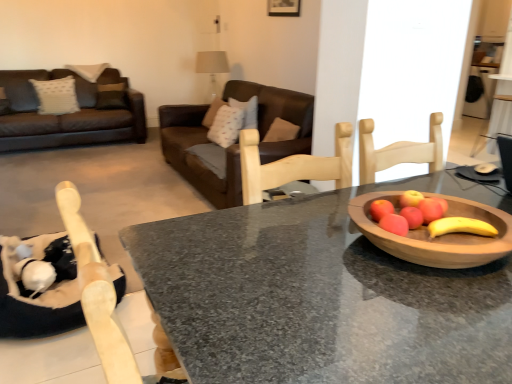
This screenshot has height=384, width=512. What are the coordinates of `vacant area to the left of red matte apple at center` in the screenshot? It's located at pos(335,238).